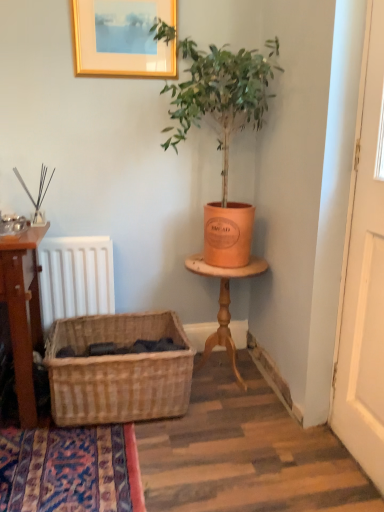
Identify the location of free space between white wooden door at right and woven natural basket at lower left. (241, 440).